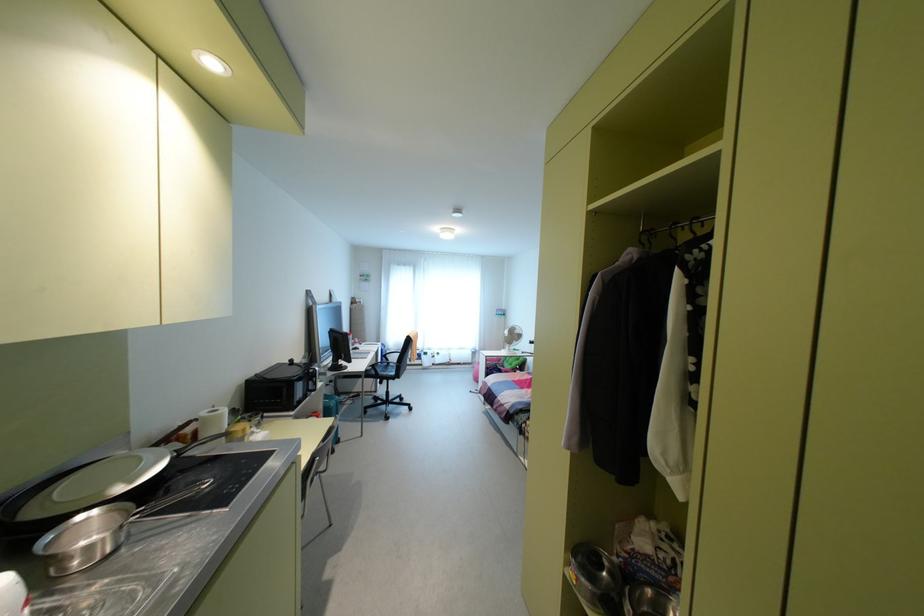
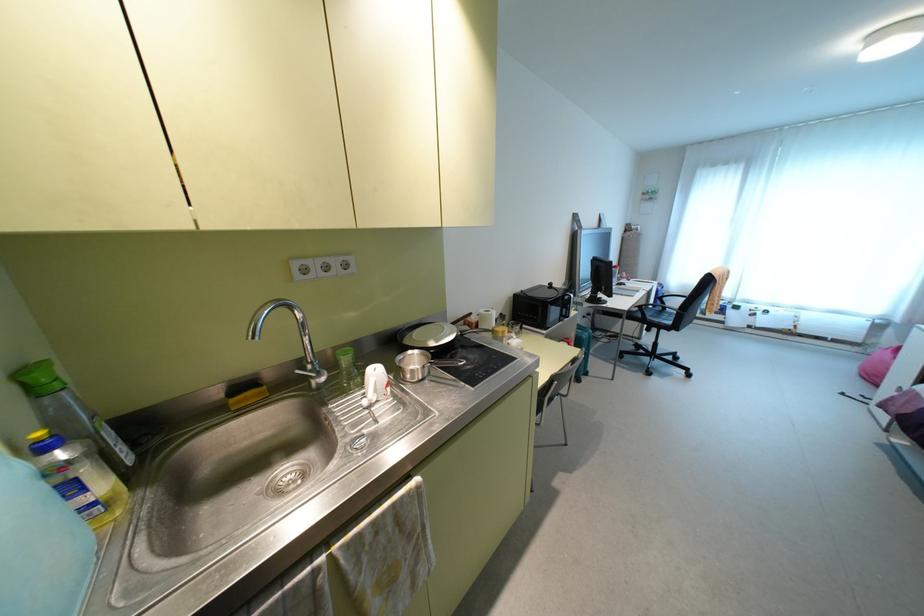
Where in the second image is the point corresponding to [392,373] from the first image?

(667, 322)